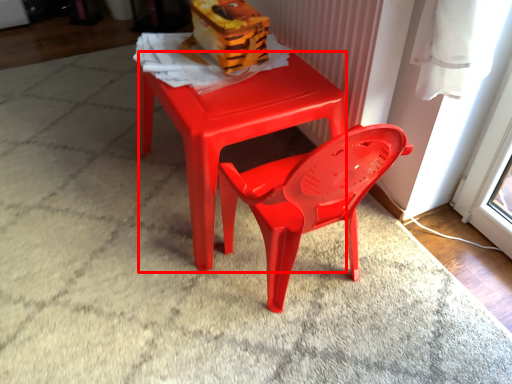
Question: From the image's perspective, considering the relative positions of table (annotated by the red box) and toy in the image provided, where is table (annotated by the red box) located with respect to the staircase?

Choices:
 (A) below
 (B) above

Answer: (A)